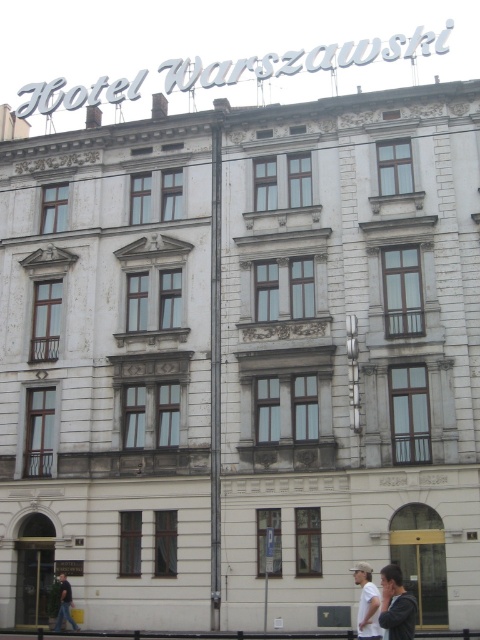
You are a guest at Hotel Warszawawski and you see the dark gray hoodie at center and the dark gray cotton shirt at lower left hanging on a rack. Which clothing item is higher up?

The dark gray hoodie at center is higher up than the dark gray cotton shirt at lower left because it is located above it.

You are standing in front of the Hotel Warszawawski building and see the dark gray hoodie at center and the white cotton shirt at lower right. Which clothing item is closer to you?

The dark gray hoodie at center is closer to you because it is in front of the white cotton shirt at lower right.

You are a fashion designer observing the Hotel Warszawawski building facade. You notice a dark gray hoodie at center and a white cotton shirt at lower right. Which clothing item appears taller?

The white cotton shirt at lower right is taller than the dark gray hoodie at center.